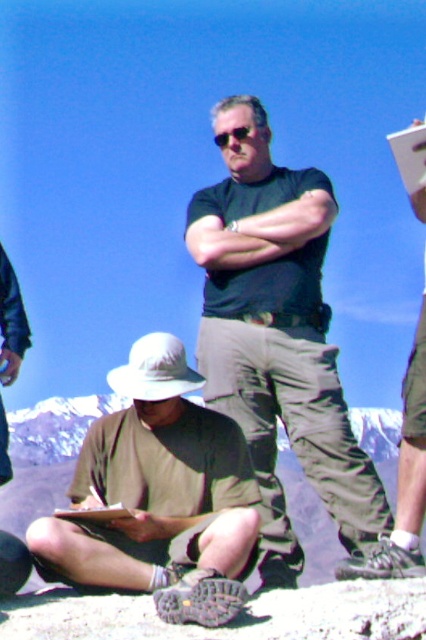
Which is above, tan fabric hat at lower left or matte black shirt at center?

Positioned higher is matte black shirt at center.

Who is more distant from viewer, (69, 545) or (414, 449)?

The point (414, 449) is more distant.

Is point (127, 566) farther from viewer compared to point (409, 442)?

No, it is not.

This screenshot has width=426, height=640. Find the location of `tan fabric hat at lower left`. tan fabric hat at lower left is located at coordinates (160, 496).

Is black matte shirt at center below reflective plastic sunglasses at center?

Yes.

Does black matte shirt at center have a lesser width compared to reflective plastic sunglasses at center?

No, black matte shirt at center is not thinner than reflective plastic sunglasses at center.

Is point (226, 284) positioned after point (239, 131)?

No, (226, 284) is in front of (239, 131).

Where is `black matte shirt at center`? The width and height of the screenshot is (426, 640). black matte shirt at center is located at coordinates (278, 339).

Is point (340, 570) closer to camera compared to point (420, 156)?

Yes, point (340, 570) is in front of point (420, 156).

Can you confirm if matte black shirt at center is wider than white paper at upper right?

Yes.

In order to click on matte black shirt at center in this screenshot , I will do `click(405, 477)`.